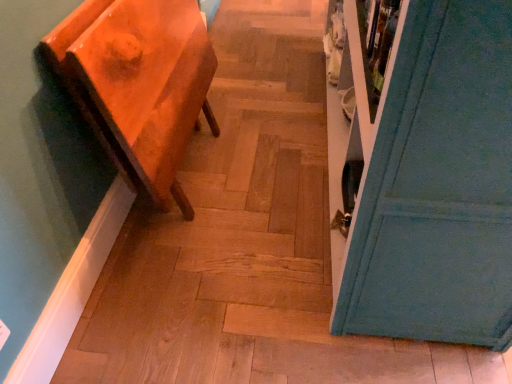
Identify the location of teal painted door at right. (422, 169).

What do you see at coordinates (422, 169) in the screenshot? This screenshot has height=384, width=512. I see `teal painted door at right` at bounding box center [422, 169].

The width and height of the screenshot is (512, 384). In order to click on matte orange side table at left in this screenshot , I will do `click(138, 83)`.

The height and width of the screenshot is (384, 512). What do you see at coordinates (138, 83) in the screenshot? I see `matte orange side table at left` at bounding box center [138, 83].

Where is `teal painted door at right`? This screenshot has height=384, width=512. teal painted door at right is located at coordinates (422, 169).

In the image, is teal painted door at right on the left side or the right side of matte orange side table at left?

teal painted door at right is to the right of matte orange side table at left.

Considering the positions of objects teal painted door at right and matte orange side table at left in the image provided, who is in front, teal painted door at right or matte orange side table at left?

teal painted door at right is more forward.

Is point (459, 240) more distant than point (136, 159)?

No, it is in front of (136, 159).

From the image's perspective, between teal painted door at right and matte orange side table at left, who is located below?

matte orange side table at left, from the image's perspective.

From a real-world perspective, between teal painted door at right and matte orange side table at left, who is vertically lower?

matte orange side table at left.

Which of these two, teal painted door at right or matte orange side table at left, is thinner?

matte orange side table at left is thinner.

Is teal painted door at right taller than matte orange side table at left?

Indeed, teal painted door at right has a greater height compared to matte orange side table at left.

Who is smaller, teal painted door at right or matte orange side table at left?

matte orange side table at left is smaller.

From the picture: Is matte orange side table at left surrounded by teal painted door at right?

No, matte orange side table at left is located outside of teal painted door at right.

Can you see teal painted door at right touching matte orange side table at left?

No.

Is teal painted door at right oriented towards matte orange side table at left?

Yes, teal painted door at right is oriented towards matte orange side table at left.

How many degrees apart are the facing directions of teal painted door at right and matte orange side table at left?

teal painted door at right and matte orange side table at left are facing 180 degrees away from each other.

How distant is teal painted door at right from matte orange side table at left?

teal painted door at right is 26.07 inches away from matte orange side table at left.

This screenshot has height=384, width=512. What are the coordinates of `furniture on the left of teal painted door at right` in the screenshot? It's located at (138, 83).

Between matte orange side table at left and teal painted door at right, which one appears on the left side from the viewer's perspective?

matte orange side table at left is more to the left.

Which object is more forward, matte orange side table at left or teal painted door at right?

teal painted door at right.

Between point (137, 110) and point (376, 297), which one is positioned behind?

The point (137, 110) is behind.

From the image's perspective, who appears lower, matte orange side table at left or teal painted door at right?

matte orange side table at left.

From a real-world perspective, is matte orange side table at left positioned under teal painted door at right based on gravity?

Yes, from a real-world perspective, matte orange side table at left is beneath teal painted door at right.

Can you confirm if matte orange side table at left is wider than teal painted door at right?

In fact, matte orange side table at left might be narrower than teal painted door at right.

Between matte orange side table at left and teal painted door at right, which one has more height?

teal painted door at right.

Who is bigger, matte orange side table at left or teal painted door at right?

With larger size is teal painted door at right.

Would you say teal painted door at right is part of matte orange side table at left's contents?

No, teal painted door at right is located outside of matte orange side table at left.

Does matte orange side table at left touch teal painted door at right?

No.

Is matte orange side table at left positioned with its back to teal painted door at right?

No, matte orange side table at left is not facing away from teal painted door at right.

Measure the distance between matte orange side table at left and teal painted door at right.

The distance of matte orange side table at left from teal painted door at right is 26.07 inches.

Where is `door that appears in front of the matte orange side table at left`? The image size is (512, 384). door that appears in front of the matte orange side table at left is located at coordinates (422, 169).

Where is `door above the matte orange side table at left (from the image's perspective)`? The width and height of the screenshot is (512, 384). door above the matte orange side table at left (from the image's perspective) is located at coordinates (422, 169).

The image size is (512, 384). Find the location of `door that is above the matte orange side table at left (from a real-world perspective)`. door that is above the matte orange side table at left (from a real-world perspective) is located at coordinates (422, 169).